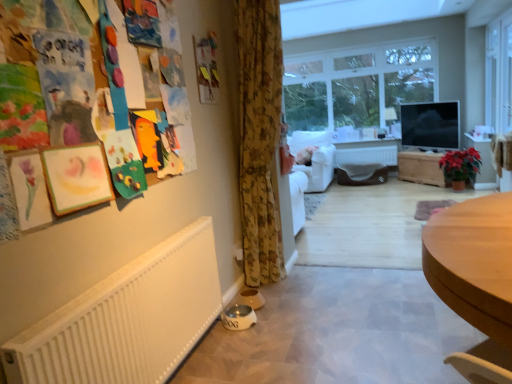
Question: Is point (316, 134) closer or farther from the camera than point (410, 178)?

Choices:
 (A) farther
 (B) closer

Answer: (A)

Question: Relative to wooden chest at center, is white fabric armchair at center in front or behind?

Choices:
 (A) front
 (B) behind

Answer: (B)

Question: Considering the real-world distances, which object is farthest from the white glossy dog bowl at lower left?

Choices:
 (A) transparent glass window at upper right, which is counted as the 1th window, starting from the front
 (B) wooden chest at center
 (C) floral fabric curtain at center
 (D) clear glass window at center, which ranks as the second window in front-to-back order
 (E) light brown wooden desk at lower right

Answer: (D)

Question: Which object is the farthest from the white glossy dog bowl at lower left?

Choices:
 (A) clear glass window at center, which appears as the 1th window when viewed from the back
 (B) white fabric armchair at center
 (C) floral fabric curtain at center
 (D) wooden chest at center
 (E) transparent glass window at upper right, the 2th window in the back-to-front sequence

Answer: (A)